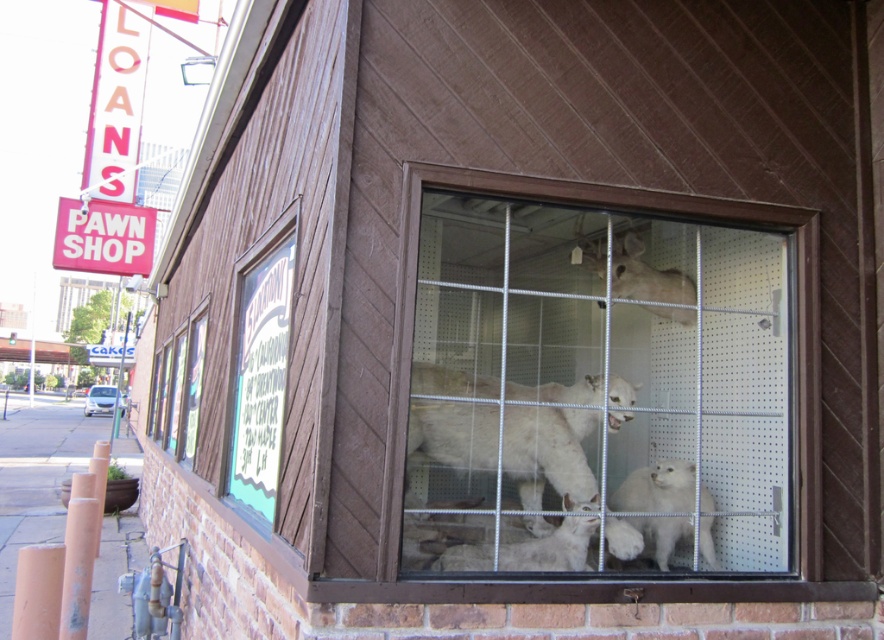
Question: Does white fur taxidermy animals at center appear on the left side of white fluffy lamb at center?

Choices:
 (A) yes
 (B) no

Answer: (A)

Question: Which object is the closest to the white fur deer at upper center?

Choices:
 (A) white fur taxidermy animals at center
 (B) white fluffy lamb at center

Answer: (A)

Question: Estimate the real-world distances between objects in this image. Which object is farther from the white fur taxidermy animals at center?

Choices:
 (A) white fluffy lamb at center
 (B) white fur deer at upper center

Answer: (A)

Question: Which of the following is the farthest from the observer?

Choices:
 (A) white fur deer at upper center
 (B) white fur taxidermy animals at center
 (C) white fluffy lamb at center

Answer: (A)

Question: Is white fur taxidermy animals at center thinner than white fur deer at upper center?

Choices:
 (A) yes
 (B) no

Answer: (B)

Question: Is white fur taxidermy animals at center wider than white fluffy lamb at center?

Choices:
 (A) no
 (B) yes

Answer: (B)